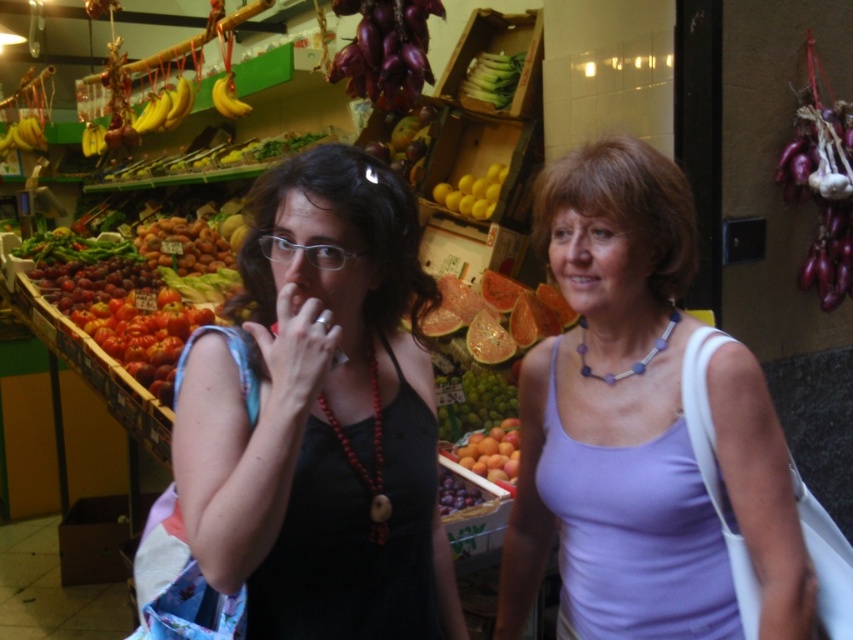
In the scene shown: You are a customer at the market and want to buy a fruit that is wider than the other. Which one should you choose between the ripe yellow apricots at center and the yellow matte lemons at center?

The ripe yellow apricots at center are wider than the yellow matte lemons at center, so you should choose the ripe yellow apricots at center.

You are standing at the camera position in the fruit and vegetable market scene. There is a point at coordinates point [489,99]. Can you reach this point without moving your feet?

The point at coordinates point [489,99] is 11.64 feet away from the camera. Since you are standing at the camera position, you cannot reach this point without moving your feet because it is too far away.

You are standing at the entrance of the market and want to reach the exit, which is located at point (485, 445). There is an obstacle at point (550, 348). Can you walk directly to the exit without going around the obstacle?

Point (550, 348) is in front of point (485, 445), so you cannot walk directly to the exit at point (485, 445) without going around the obstacle at point (550, 348).